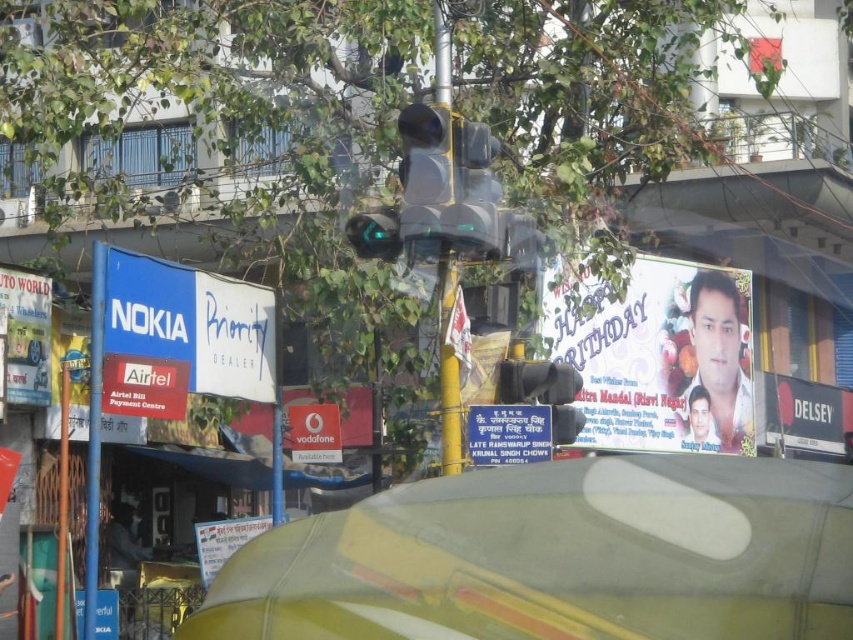
Question: Does yellow matte traffic light at center appear under metallic signboard at left?

Choices:
 (A) yes
 (B) no

Answer: (B)

Question: Which of the following is the closest to the observer?

Choices:
 (A) (735, 394)
 (B) (508, 428)

Answer: (B)

Question: Is camouflage fabric car at center to the left of matte paper billboard at upper right from the viewer's perspective?

Choices:
 (A) no
 (B) yes

Answer: (B)

Question: Which object is closer to the camera taking this photo?

Choices:
 (A) metallic signboard at left
 (B) matte paper billboard at upper right

Answer: (A)

Question: Is black matte sign at right bigger than red plastic sign at center?

Choices:
 (A) no
 (B) yes

Answer: (A)

Question: Estimate the real-world distances between objects in this image. Which object is farther from the matte paper billboard at upper right?

Choices:
 (A) red plastic sign at center
 (B) blue plastic signboard at center
 (C) yellow metallic pole at center
 (D) camouflage fabric car at center

Answer: (D)